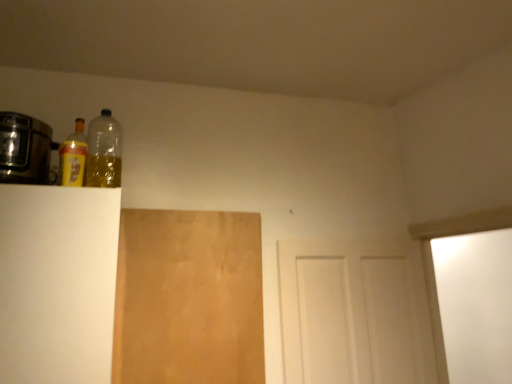
Question: From the image's perspective, is brown matte plywood at center-left located above white matte door at center?

Choices:
 (A) no
 (B) yes

Answer: (B)

Question: Is the surface of brown matte plywood at center-left in direct contact with white matte door at center?

Choices:
 (A) yes
 (B) no

Answer: (B)

Question: From a real-world perspective, is brown matte plywood at center-left under white matte door at center?

Choices:
 (A) yes
 (B) no

Answer: (B)

Question: Can you confirm if brown matte plywood at center-left is shorter than white matte door at center?

Choices:
 (A) yes
 (B) no

Answer: (B)

Question: Can you confirm if brown matte plywood at center-left is wider than white matte door at center?

Choices:
 (A) yes
 (B) no

Answer: (B)

Question: Is point (95, 304) positioned closer to the camera than point (205, 261)?

Choices:
 (A) closer
 (B) farther

Answer: (A)

Question: From the image's perspective, relative to brown matte plywood at center-left, is white matte cabinet at left above or below?

Choices:
 (A) below
 (B) above

Answer: (B)

Question: From their relative heights in the image, would you say white matte cabinet at left is taller or shorter than brown matte plywood at center-left?

Choices:
 (A) short
 (B) tall

Answer: (A)

Question: Is white matte cabinet at left bigger or smaller than brown matte plywood at center-left?

Choices:
 (A) big
 (B) small

Answer: (A)

Question: Is metallic silver toaster at left taller or shorter than yellow matte bottle at upper left, marked as the 2th bottle in a right-to-left arrangement?

Choices:
 (A) tall
 (B) short

Answer: (B)

Question: Considering the positions of metallic silver toaster at left and yellow matte bottle at upper left, which is counted as the 1th bottle, starting from the left, in the image, is metallic silver toaster at left wider or thinner than yellow matte bottle at upper left, which is counted as the 1th bottle, starting from the left,?

Choices:
 (A) thin
 (B) wide

Answer: (B)

Question: From a real-world perspective, is metallic silver toaster at left above or below yellow matte bottle at upper left, marked as the 2th bottle in a right-to-left arrangement?

Choices:
 (A) below
 (B) above

Answer: (A)

Question: Is metallic silver toaster at left to the left or to the right of yellow matte bottle at upper left, which is counted as the 1th bottle, starting from the left, in the image?

Choices:
 (A) right
 (B) left

Answer: (B)

Question: Looking at the image, does brown matte plywood at center-left seem bigger or smaller compared to metallic silver toaster at left?

Choices:
 (A) small
 (B) big

Answer: (B)

Question: Looking at their shapes, would you say brown matte plywood at center-left is wider or thinner than metallic silver toaster at left?

Choices:
 (A) wide
 (B) thin

Answer: (B)